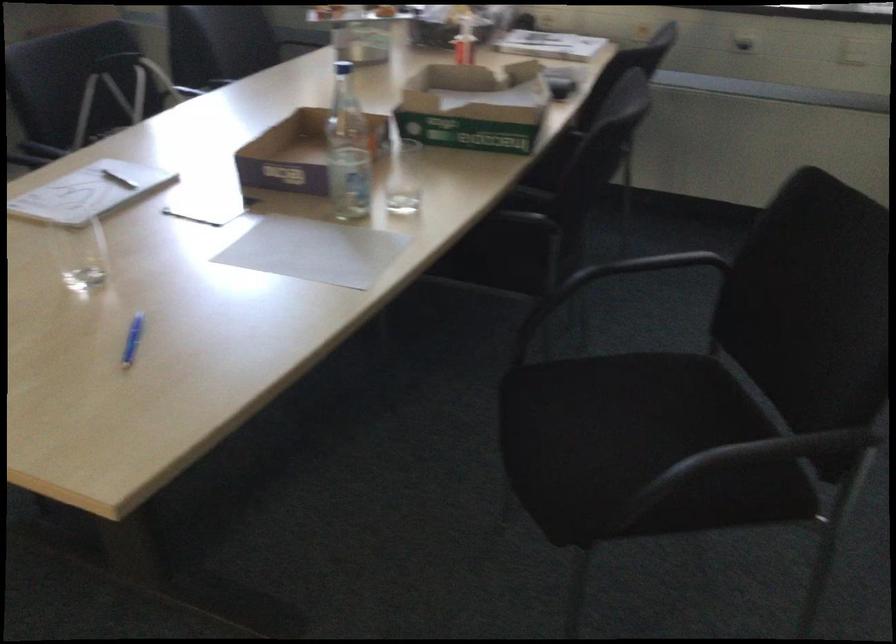
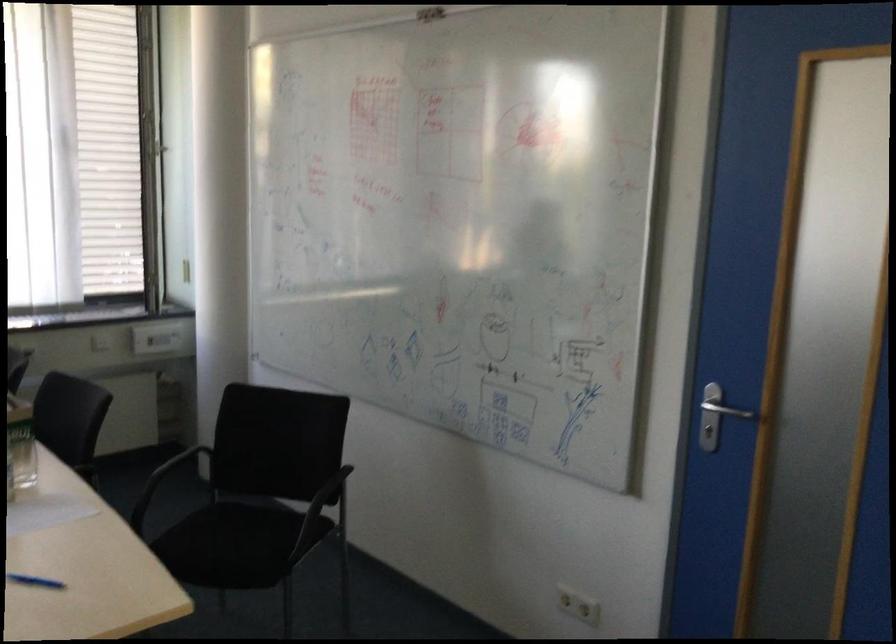
In the second image, find the point that corresponds to [640,438] in the first image.

(251, 529)